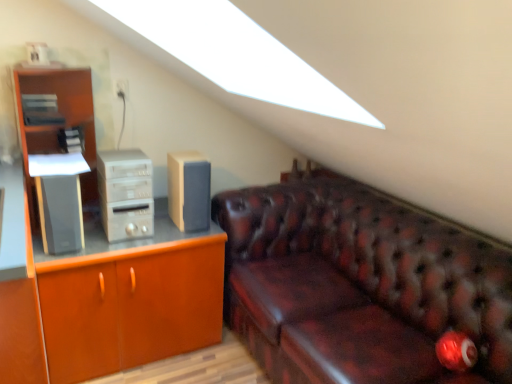
Question: From a real-world perspective, is beige fabric speaker at center, which is the first speaker from right to left, on satin silver computer tower at left?

Choices:
 (A) yes
 (B) no

Answer: (B)

Question: Considering the relative positions of beige fabric speaker at center, the 2th speaker when ordered from left to right, and satin silver computer tower at left in the image provided, is beige fabric speaker at center, the 2th speaker when ordered from left to right, in front of satin silver computer tower at left?

Choices:
 (A) yes
 (B) no

Answer: (B)

Question: From the image's perspective, would you say beige fabric speaker at center, the 2th speaker when ordered from left to right, is positioned over satin silver computer tower at left?

Choices:
 (A) yes
 (B) no

Answer: (A)

Question: From a real-world perspective, does beige fabric speaker at center, the 2th speaker when ordered from left to right, sit lower than satin silver computer tower at left?

Choices:
 (A) yes
 (B) no

Answer: (A)

Question: From the image's perspective, is beige fabric speaker at center, the 2th speaker when ordered from left to right, under satin silver computer tower at left?

Choices:
 (A) no
 (B) yes

Answer: (A)

Question: In the image, is beige fabric speaker at center, which is the first speaker from right to left, positioned in front of or behind leather couch at right?

Choices:
 (A) behind
 (B) front

Answer: (A)

Question: In the image, is beige fabric speaker at center, the 2th speaker when ordered from left to right, on the left side or the right side of leather couch at right?

Choices:
 (A) right
 (B) left

Answer: (B)

Question: From a real-world perspective, is beige fabric speaker at center, which is the first speaker from right to left, above or below leather couch at right?

Choices:
 (A) above
 (B) below

Answer: (A)

Question: Choose the correct answer: Is beige fabric speaker at center, the 2th speaker when ordered from left to right, inside leather couch at right or outside it?

Choices:
 (A) outside
 (B) inside

Answer: (A)

Question: Considering the positions of beige fabric speaker at center, the 2th speaker when ordered from left to right, and satin black speaker at left, the 1th speaker in the left-to-right sequence, in the image, is beige fabric speaker at center, the 2th speaker when ordered from left to right, wider or thinner than satin black speaker at left, the 1th speaker in the left-to-right sequence,?

Choices:
 (A) wide
 (B) thin

Answer: (A)

Question: Looking at the image, does beige fabric speaker at center, which is the first speaker from right to left, seem bigger or smaller compared to satin black speaker at left, which is counted as the second speaker, starting from the right?

Choices:
 (A) big
 (B) small

Answer: (A)

Question: Does point (202, 206) appear closer or farther from the camera than point (42, 195)?

Choices:
 (A) closer
 (B) farther

Answer: (B)

Question: From a real-world perspective, is beige fabric speaker at center, which is the first speaker from right to left, above or below satin black speaker at left, the 1th speaker in the left-to-right sequence?

Choices:
 (A) below
 (B) above

Answer: (B)

Question: In terms of width, does satin black speaker at left, which is counted as the second speaker, starting from the right, look wider or thinner when compared to matte wood cabinet at left?

Choices:
 (A) thin
 (B) wide

Answer: (A)

Question: Considering their positions, is satin black speaker at left, which is counted as the second speaker, starting from the right, located in front of or behind matte wood cabinet at left?

Choices:
 (A) front
 (B) behind

Answer: (A)